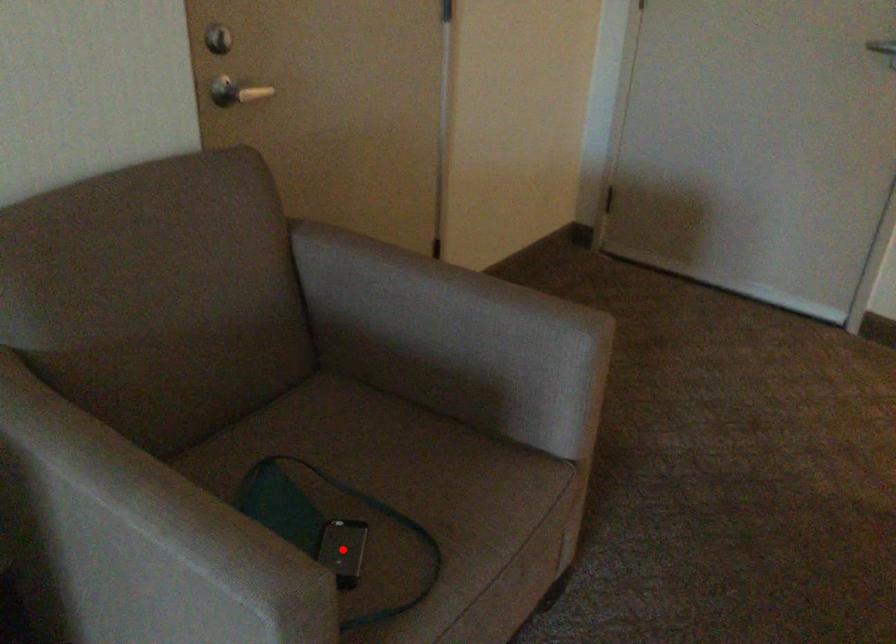
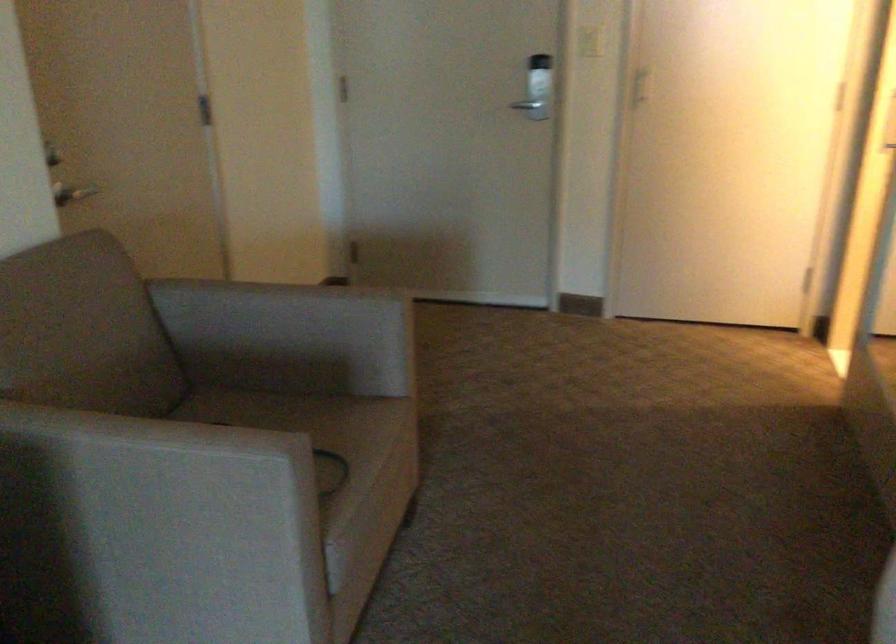
Question: I am providing you with two images of the same scene from different viewpoints. A red point is marked on the first image. Can you still see the location of the red point in image 2?

Choices:
 (A) Yes
 (B) No

Answer: (B)